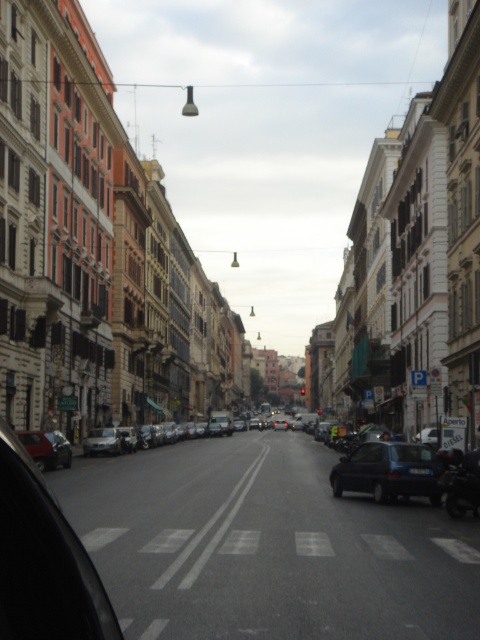
Is matte black car at lower left taller than silver metallic sedan at left?

Yes.

Does matte black car at lower left appear over silver metallic sedan at left?

Yes.

Is point (20, 440) more distant than point (95, 451)?

No, (20, 440) is closer to viewer.

You are a GUI agent. You are given a task and a screenshot of the screen. Output one action in this format:
    pyautogui.click(x=<x>, y=<y>)
    Task: Click on the matte black car at lower left
    
    Given the screenshot: What is the action you would take?
    pyautogui.click(x=47, y=449)

Can you confirm if blue metallic car at center is positioned above matte black car at lower left?

Indeed, blue metallic car at center is positioned over matte black car at lower left.

Does blue metallic car at center have a lesser height compared to matte black car at lower left?

Yes.

Does point (414, 476) come in front of point (43, 436)?

That is True.

Identify the location of blue metallic car at center. This screenshot has width=480, height=640. (387, 472).

Does point (379, 474) lie in front of point (421, 470)?

No, it is not.

Which is in front, point (358, 481) or point (414, 468)?

Point (414, 468) is more forward.

Describe the element at coordinates (387, 472) in the screenshot. This screenshot has height=640, width=480. I see `blue metallic car at center` at that location.

Identify the location of blue metallic car at center. This screenshot has width=480, height=640. (387, 472).